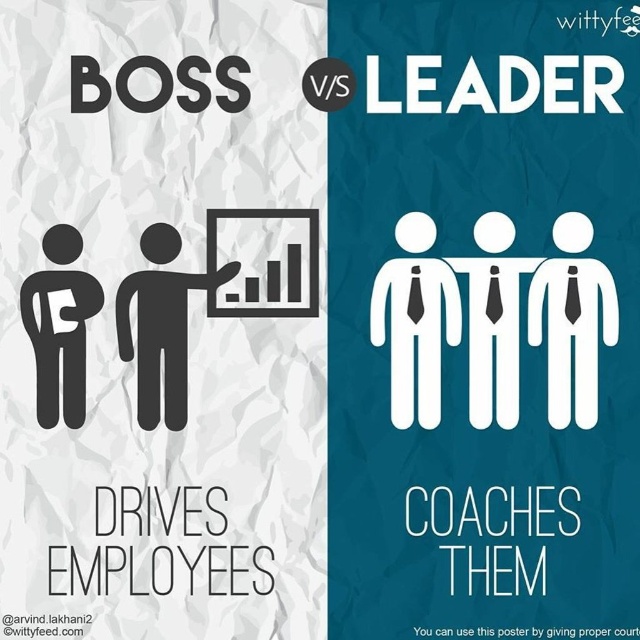
In the scene shown: Is white paper people at center further to camera compared to matte black figure at left?

No, it is not.

Which is in front, point (440, 259) or point (68, 381)?

Point (68, 381) is in front.

Describe the element at coordinates (493, 333) in the screenshot. The image size is (640, 640). I see `white paper people at center` at that location.

Where is `white paper people at center`? The width and height of the screenshot is (640, 640). white paper people at center is located at coordinates (493, 333).

From the picture: Does white paper at center appear over black figure at center?

Yes, white paper at center is above black figure at center.

Who is positioned more to the left, white paper at center or black figure at center?

From the viewer's perspective, black figure at center appears more on the left side.

Is point (486, 403) positioned in front of point (154, 349)?

No, (486, 403) is further to viewer.

Locate an element on the screen. This screenshot has width=640, height=640. white paper at center is located at coordinates (483, 321).

In the scene shown: Is white paper at center shorter than white paper people at center?

Incorrect, white paper at center's height does not fall short of white paper people at center's.

Which is more to the right, white paper at center or white paper people at center?

From the viewer's perspective, white paper people at center appears more on the right side.

This screenshot has width=640, height=640. Find the location of `white paper at center`. white paper at center is located at coordinates (483, 321).

This screenshot has height=640, width=640. Identify the location of white paper at center. (483, 321).